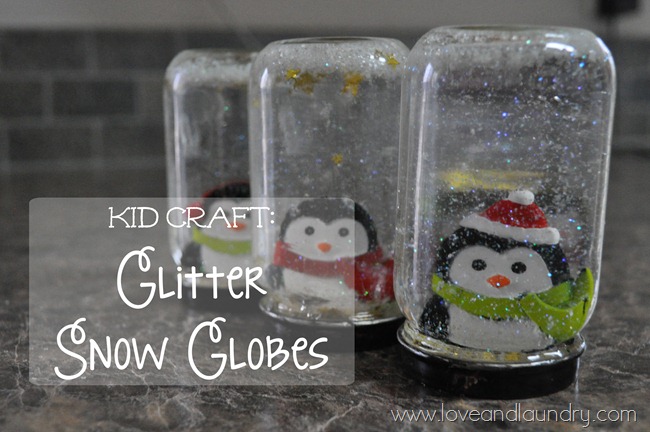
The height and width of the screenshot is (432, 650). I want to click on counter, so click(289, 403).